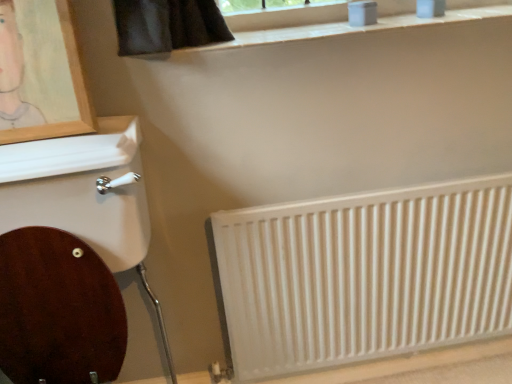
Question: From their relative heights in the image, would you say wooden picture frame at upper left is taller or shorter than white textured radiator at lower right?

Choices:
 (A) short
 (B) tall

Answer: (A)

Question: Considering the relative positions of wooden picture frame at upper left and white textured radiator at lower right in the image provided, is wooden picture frame at upper left to the left or to the right of white textured radiator at lower right?

Choices:
 (A) left
 (B) right

Answer: (A)

Question: Based on their sizes in the image, would you say wooden picture frame at upper left is bigger or smaller than white textured radiator at lower right?

Choices:
 (A) big
 (B) small

Answer: (B)

Question: Considering the positions of white textured radiator at lower right and wooden picture frame at upper left in the image, is white textured radiator at lower right taller or shorter than wooden picture frame at upper left?

Choices:
 (A) tall
 (B) short

Answer: (A)

Question: Is white textured radiator at lower right situated inside wooden picture frame at upper left or outside?

Choices:
 (A) outside
 (B) inside

Answer: (A)

Question: In the image, is white textured radiator at lower right positioned in front of or behind wooden picture frame at upper left?

Choices:
 (A) behind
 (B) front

Answer: (A)

Question: Considering the positions of white textured radiator at lower right and wooden picture frame at upper left in the image, is white textured radiator at lower right wider or thinner than wooden picture frame at upper left?

Choices:
 (A) wide
 (B) thin

Answer: (B)